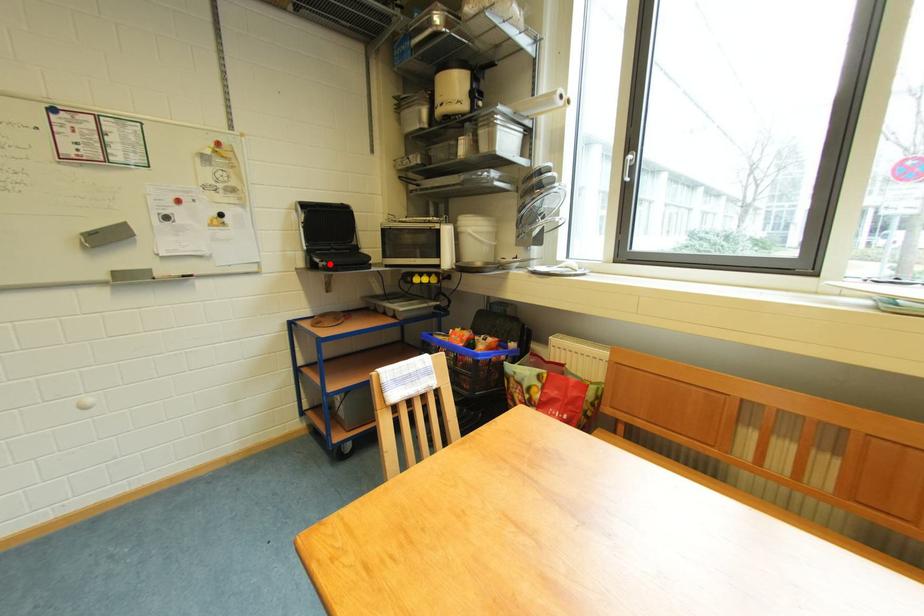
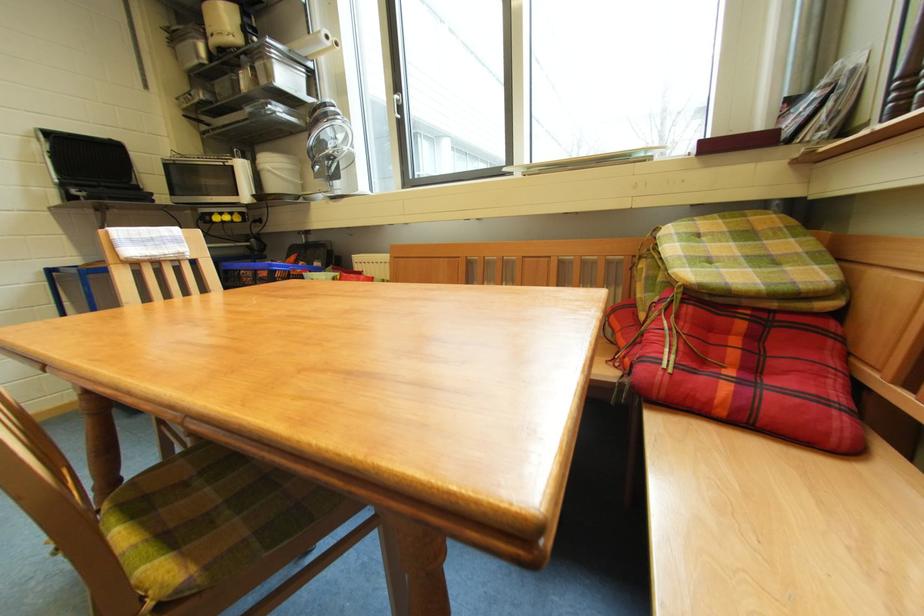
Locate, in the second image, the point that corresponds to the highlighted location in the first image.

(88, 193)